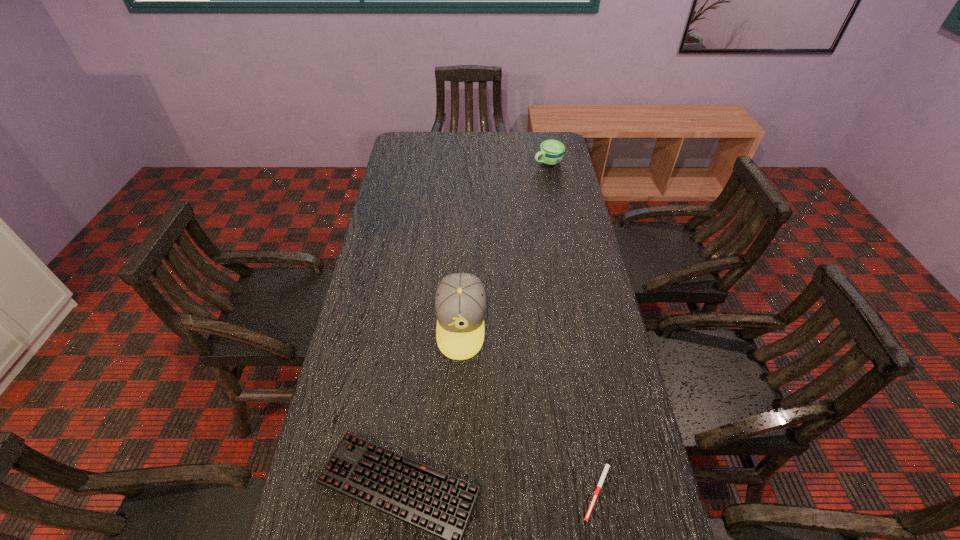
You are a GUI agent. You are given a task and a screenshot of the screen. Output one action in this format:
    pyautogui.click(x=<x>, y=<y>)
    Task: Click on the free point between the farthest object and the baseball cap
    The width and height of the screenshot is (960, 540).
    Given the screenshot: What is the action you would take?
    pyautogui.click(x=504, y=244)

Select which object appears as the second closest to the third shortest object. Please provide its 2D coordinates. Your answer should be formatted as a tuple, i.e. [(x, y)], where the tuple contains the x and y coordinates of a point satisfying the conditions above.

[(436, 502)]

Locate an element on the screen. This screenshot has width=960, height=540. object that is the second closest to the third nearest object is located at coordinates (606, 468).